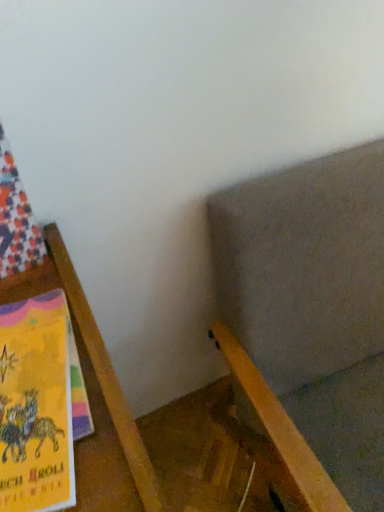
Question: Is the position of wooden chair at lower right less distant than that of wooden bookshelf at left?

Choices:
 (A) yes
 (B) no

Answer: (B)

Question: Is wooden chair at lower right positioned with its back to wooden bookshelf at left?

Choices:
 (A) no
 (B) yes

Answer: (A)

Question: Is wooden chair at lower right outside of wooden bookshelf at left?

Choices:
 (A) no
 (B) yes

Answer: (B)

Question: Is wooden chair at lower right far away from wooden bookshelf at left?

Choices:
 (A) yes
 (B) no

Answer: (B)

Question: Is wooden chair at lower right at the left side of wooden bookshelf at left?

Choices:
 (A) yes
 (B) no

Answer: (B)

Question: Is wooden chair at lower right thinner than wooden bookshelf at left?

Choices:
 (A) no
 (B) yes

Answer: (A)

Question: Considering the relative sizes of wooden bookshelf at left and wooden chair at lower right in the image provided, is wooden bookshelf at left thinner than wooden chair at lower right?

Choices:
 (A) no
 (B) yes

Answer: (B)

Question: Is wooden chair at lower right surrounded by wooden bookshelf at left?

Choices:
 (A) yes
 (B) no

Answer: (B)

Question: Would you say wooden bookshelf at left is a long distance from wooden chair at lower right?

Choices:
 (A) yes
 (B) no

Answer: (B)

Question: Does wooden bookshelf at left have a lesser height compared to wooden chair at lower right?

Choices:
 (A) no
 (B) yes

Answer: (B)

Question: From a real-world perspective, is wooden bookshelf at left physically below wooden chair at lower right?

Choices:
 (A) yes
 (B) no

Answer: (A)

Question: Is wooden bookshelf at left turned away from wooden chair at lower right?

Choices:
 (A) yes
 (B) no

Answer: (B)

Question: In terms of size, does wooden bookshelf at left appear bigger or smaller than wooden chair at lower right?

Choices:
 (A) big
 (B) small

Answer: (B)